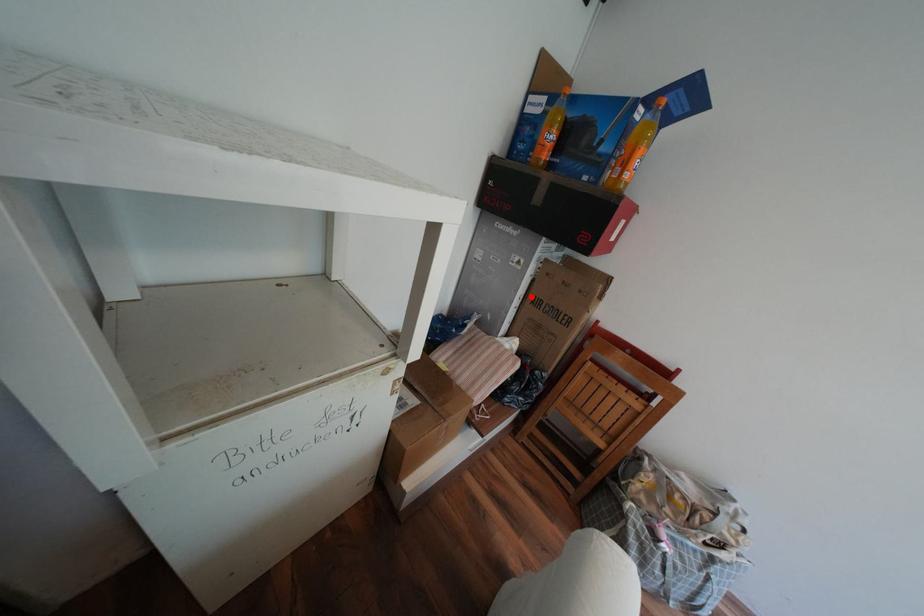
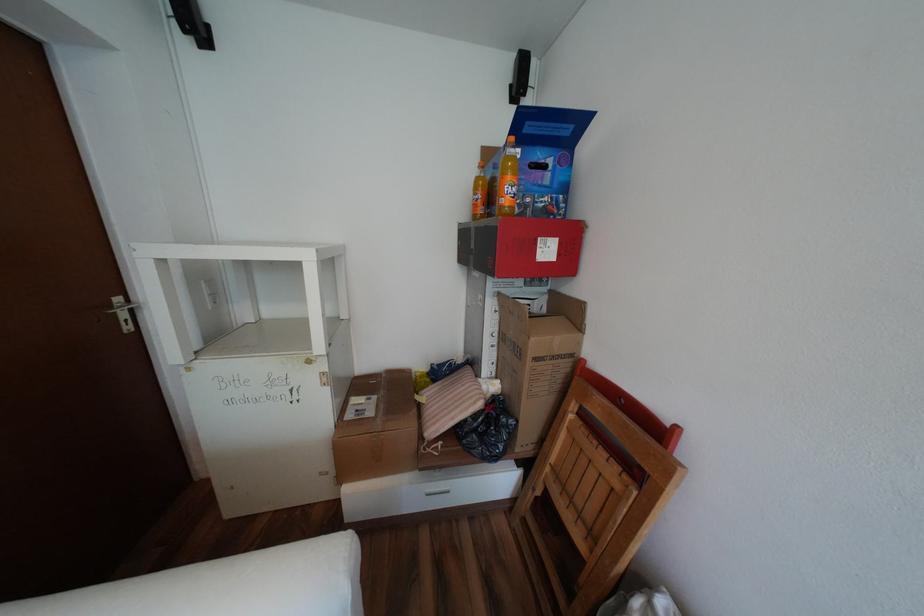
Locate, in the second image, the point that corresponds to the highlighted location in the first image.

(505, 334)